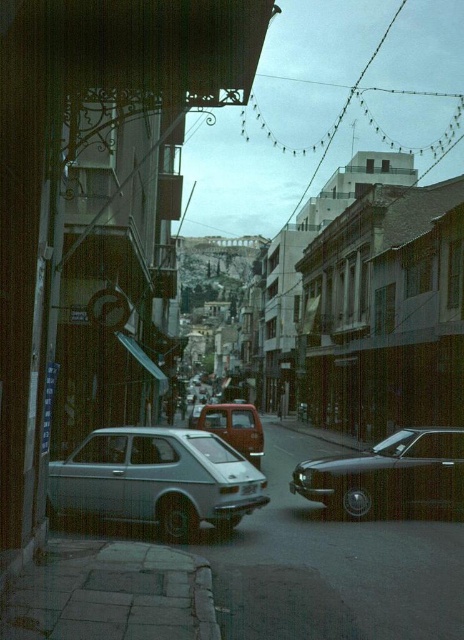
Question: Which object is closer to the camera taking this photo?

Choices:
 (A) white plastic license plate at center
 (B) matte red truck at center
 (C) light blue matte hatchback at lower left
 (D) shiny black sedan at center

Answer: (C)

Question: Among these objects, which one is nearest to the camera?

Choices:
 (A) light blue matte hatchback at lower left
 (B) matte red truck at center
 (C) white plastic license plate at center
 (D) shiny black sedan at center

Answer: (A)

Question: Is shiny black sedan at center above matte red truck at center?

Choices:
 (A) yes
 (B) no

Answer: (A)

Question: Is shiny black sedan at center above white plastic license plate at center?

Choices:
 (A) yes
 (B) no

Answer: (B)

Question: Is light blue matte hatchback at lower left smaller than white plastic license plate at center?

Choices:
 (A) yes
 (B) no

Answer: (B)

Question: Considering the real-world distances, which object is closest to the shiny black sedan at center?

Choices:
 (A) light blue matte hatchback at lower left
 (B) matte red truck at center

Answer: (A)